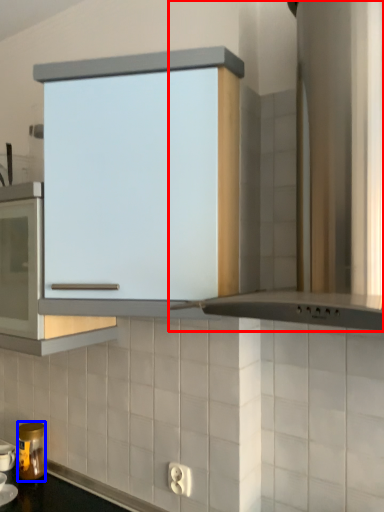
Question: Which object is further to the camera taking this photo, home appliance (highlighted by a red box) or kitchen appliance (highlighted by a blue box)?

Choices:
 (A) home appliance
 (B) kitchen appliance

Answer: (B)